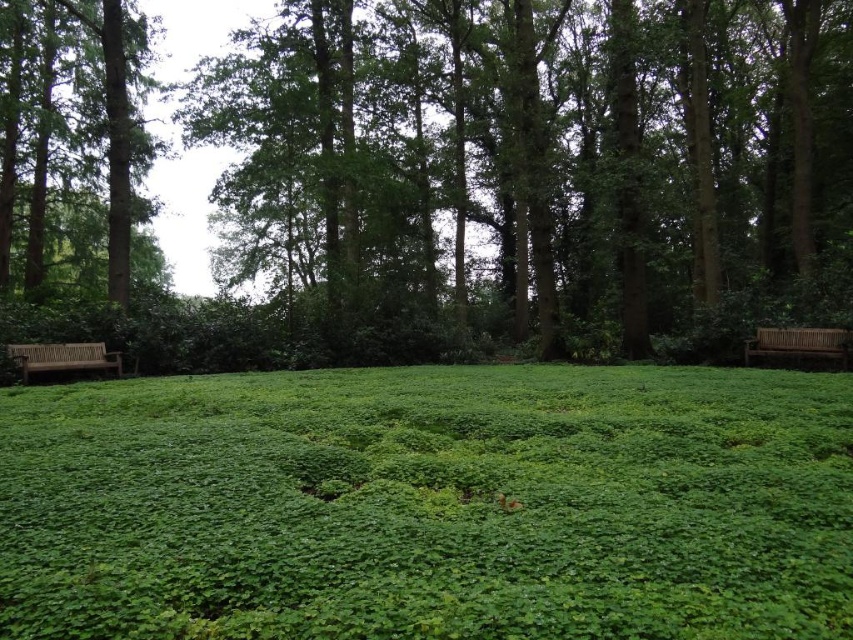
You are planning to set up a small picnic in the forest clearing shown. You have a picnic blanket that needs to be placed on the ground. Considering the green leafy grass at center and the wooden bench at left, which surface would be more suitable for laying the blanket?

The green leafy grass at center is shorter than the wooden bench at left, so the grass would be a more suitable surface for laying the picnic blanket as it is lower to the ground and provides a flat area.

You are standing in the forest clearing and want to sit down. The wooden bench at right is located at point (799, 342). Can you determine if the wooden bench at right is positioned to the right of the center of the clearing?

The wooden bench at right is located at point (799, 342). Since the x coordinate is 0.537, which is greater than 0.5, the wooden bench at right is positioned to the right of the center of the clearing.

You are a hiker who wants to sit on one of the wooden benches in the forest clearing. If you look from the ground level, which bench is positioned higher up, the wooden bench at right or the wooden bench at left?

The wooden bench at right is positioned higher up than the wooden bench at left because it is above it.